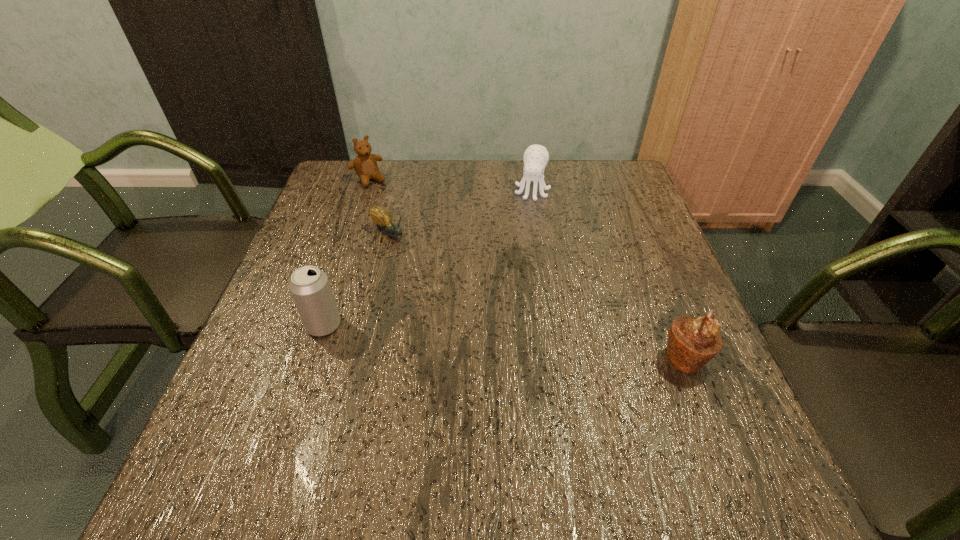
Find the location of a particular element. This screenshot has width=960, height=540. blank area located on the front-facing side of the shortest object is located at coordinates (477, 313).

At what (x,y) coordinates should I click in order to perform the action: click on vacant region located on the front-facing side of the shortest object. Please return your answer as a coordinate pair (x, y). The width and height of the screenshot is (960, 540). Looking at the image, I should click on (418, 260).

Image resolution: width=960 pixels, height=540 pixels. I want to click on vacant space located 0.130m on the front-facing side of the fourth object from left to right, so click(523, 231).

This screenshot has height=540, width=960. What are the coordinates of `blank space located 0.270m on the front-facing side of the fourth object from left to right` in the screenshot? It's located at (514, 267).

What are the coordinates of `vacant space situated 0.250m on the front-facing side of the fourth object from left to right` in the screenshot? It's located at (516, 261).

Locate an element on the screen. The height and width of the screenshot is (540, 960). vacant space located 0.050m on the front-facing side of the teddy bear is located at coordinates (382, 196).

Find the location of `vacant space located 0.350m on the front-facing side of the teddy bear`. vacant space located 0.350m on the front-facing side of the teddy bear is located at coordinates (432, 255).

The image size is (960, 540). Identify the location of vacant space located on the front-facing side of the teddy bear. (392, 206).

This screenshot has width=960, height=540. What are the coordinates of `octopus that is at the far edge` in the screenshot? It's located at (536, 157).

Where is `teddy bear that is at the far edge`? The image size is (960, 540). teddy bear that is at the far edge is located at coordinates (365, 165).